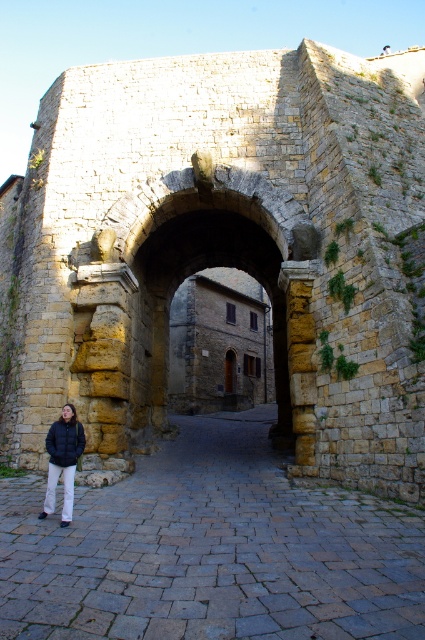
Question: Which object is farther from the camera taking this photo?

Choices:
 (A) dark blue puffer jacket at lower left
 (B) stone archway at center

Answer: (B)

Question: Does stone archway at center lie behind dark blue puffer jacket at lower left?

Choices:
 (A) no
 (B) yes

Answer: (B)

Question: Which point is closer to the camera?

Choices:
 (A) stone archway at center
 (B) dark blue puffer jacket at lower left

Answer: (B)

Question: Does stone archway at center have a smaller size compared to dark blue puffer jacket at lower left?

Choices:
 (A) yes
 (B) no

Answer: (B)

Question: Does stone archway at center appear under dark blue puffer jacket at lower left?

Choices:
 (A) yes
 (B) no

Answer: (B)